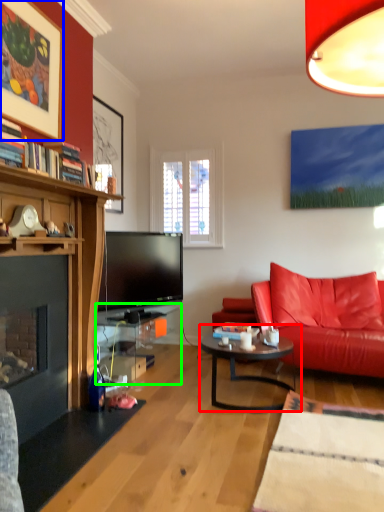
Question: Estimate the real-world distances between objects in this image. Which object is closer to coffee table (highlighted by a red box), picture frame (highlighted by a blue box) or table (highlighted by a green box)?

Choices:
 (A) picture frame
 (B) table

Answer: (B)